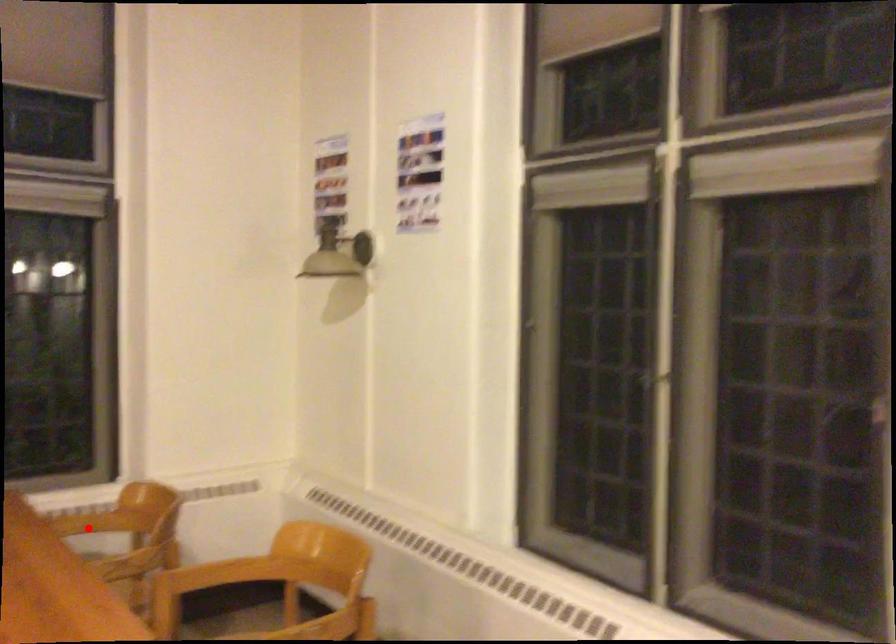
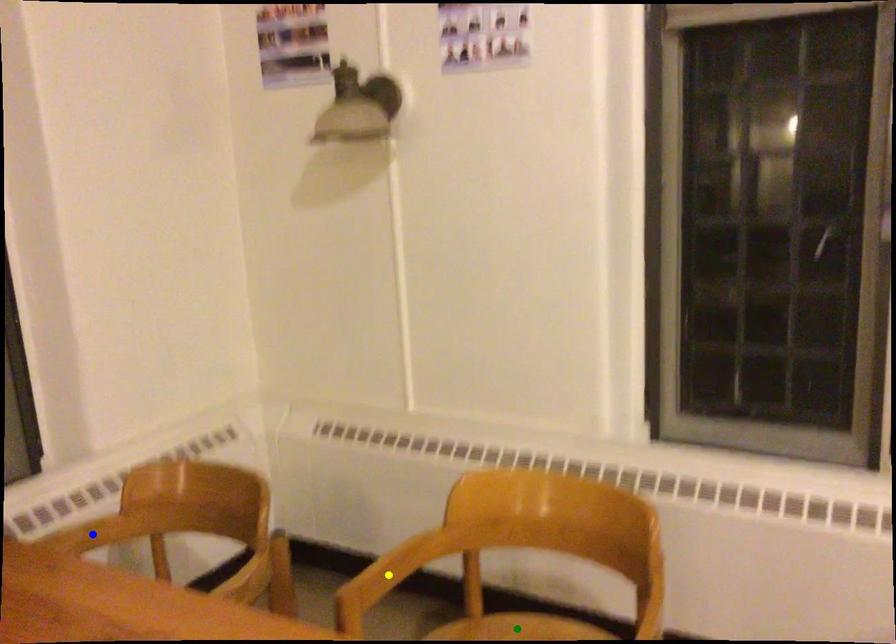
Question: I am providing you with two images of the same scene from different viewpoints. A red point is marked on the first image. You are given multiple points on the second image. Can you choose the point in image 2 that corresponds to the point in image 1?

Choices:
 (A) yellow point
 (B) blue point
 (C) green point

Answer: (B)